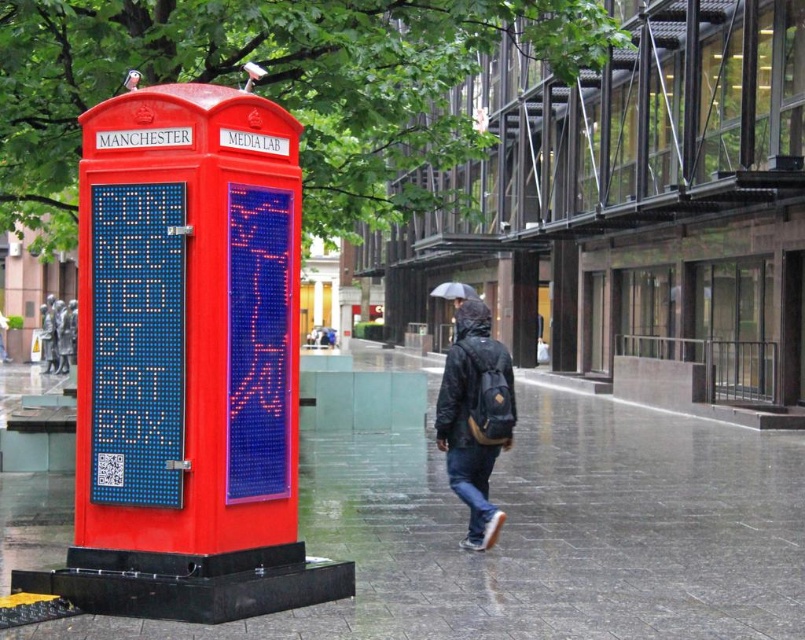
You are standing in front of the repurposed red telephone box with the digital screens. You want to place a small potted plant on the glossy concrete pavement at lower center. Where exactly should you place it?

You should place the small potted plant at the coordinates point (541, 531) where the glossy concrete pavement at lower center is located.

From the picture: You are standing at the red telephone box labeled MANCHESTER MEDIA LAB. You see two points marked on the ground. One is at point (48, 556) and the other is at point (457, 328). If you want to walk towards the point that is closer to you, which point should you choose?

Point (48, 556) is in front of point (457, 328), so you should choose point (48, 556) as it is closer to you.

You are a delivery person carrying a dark blue backpack at center and a black matte umbrella at upper center. Your task requires you to pass through a narrow doorway that is only 30 cm wide. Which item might be harder to fit through the doorway?

The black matte umbrella at upper center might be harder to fit through the doorway since it is thicker than the dark blue backpack at center, and the doorway is only 30 cm wide.